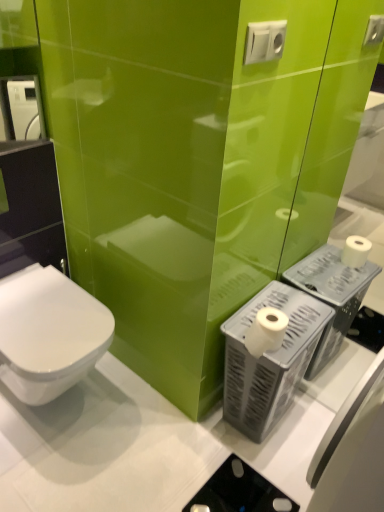
At what (x,y) coordinates should I click in order to perform the action: click on free point below white glossy toilet at lower left (from a real-world perspective). Please return your answer as a coordinate pair (x, y). The image size is (384, 512). Looking at the image, I should click on (70, 411).